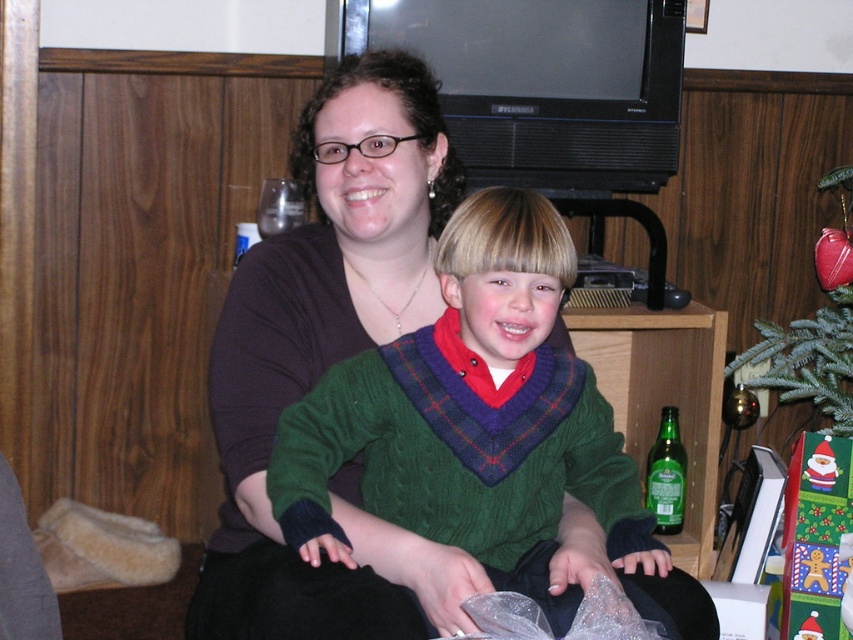
Question: Which point is farther to the camera?

Choices:
 (A) green matte christmas tree at lower right
 (B) green knitted sweater at center

Answer: (A)

Question: Is green knitted sweater at center smaller than green matte christmas tree at lower right?

Choices:
 (A) no
 (B) yes

Answer: (B)

Question: Which of the following is the closest to the observer?

Choices:
 (A) (767, 332)
 (B) (370, 417)

Answer: (B)

Question: Does green knitted sweater at center come in front of green matte christmas tree at lower right?

Choices:
 (A) no
 (B) yes

Answer: (B)

Question: Can you confirm if green knitted sweater at center is thinner than green matte christmas tree at lower right?

Choices:
 (A) no
 (B) yes

Answer: (A)